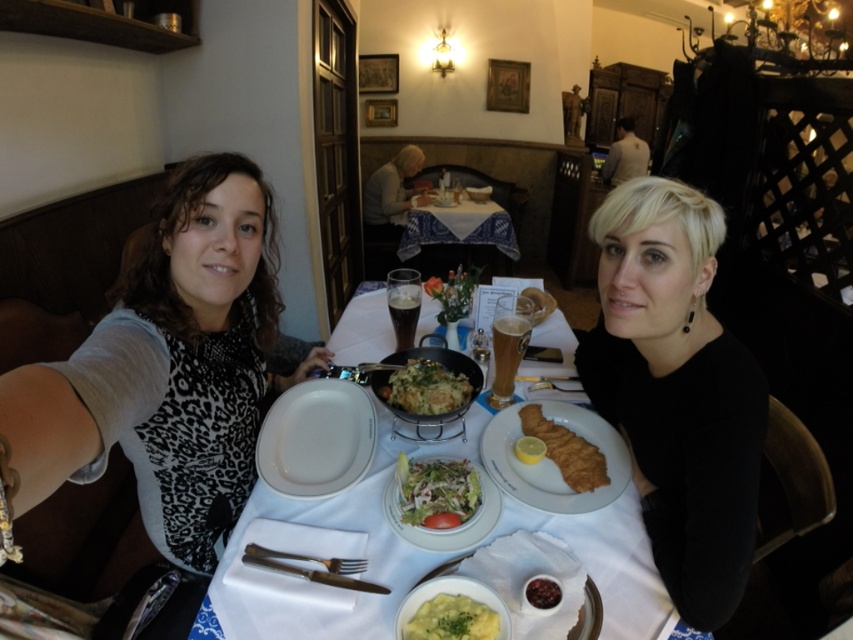
You are a chef preparing a dish and need to place both the smooth creamy mashed potatoes at center and the dark chocolate bar at center on a plate. Based on the image, which item should you place first to ensure proper layering?

The smooth creamy mashed potatoes at center should be placed first because it is positioned over the dark chocolate bar at center, indicating it should be layered on top.

You are a chef preparing a meal and see both the smooth creamy mashed potatoes at center and the dark chocolate bar at center on the table. Which one takes up more space on the table?

The smooth creamy mashed potatoes at center is bigger than the dark chocolate bar at center, so it takes up more space on the table.

In the scene shown: You are a waiter in this restaurant and need to place a new dish on the table. The table has both the black matte shirt at center and the white porcelain plates at center. Which object should you avoid placing the dish near to ensure it stays visible to the customers?

You should avoid placing the dish near the black matte shirt at center because it is closer to the viewer than the white porcelain plates at center, making it harder to see the dish if placed there.